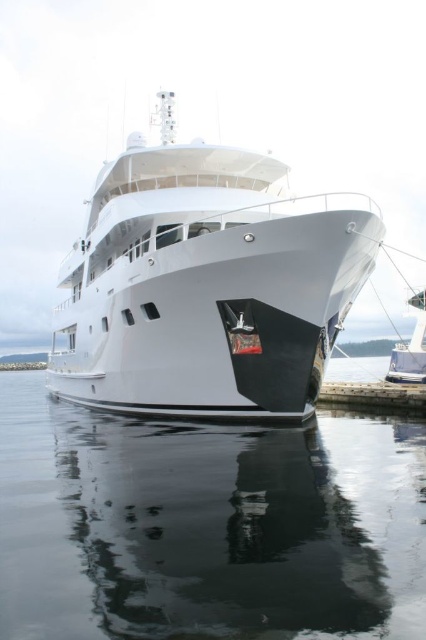
Who is positioned more to the right, white glossy yacht at center or white glossy yacht at right?

white glossy yacht at right

Is white glossy yacht at center bigger than white glossy yacht at right?

Yes, white glossy yacht at center is bigger than white glossy yacht at right.

Is point (275, 253) closer to viewer compared to point (414, 380)?

Yes, it is.

Locate an element on the screen. This screenshot has height=640, width=426. white glossy yacht at center is located at coordinates (207, 284).

Does transparent water at lower center appear on the right side of white glossy yacht at center?

No, transparent water at lower center is not to the right of white glossy yacht at center.

You are a GUI agent. You are given a task and a screenshot of the screen. Output one action in this format:
    pyautogui.click(x=<x>, y=<y>)
    Task: Click on the transparent water at lower center
    
    Given the screenshot: What is the action you would take?
    pyautogui.click(x=207, y=525)

Does point (313, 518) come farther from viewer compared to point (195, 308)?

No, it is in front of (195, 308).

This screenshot has width=426, height=640. I want to click on transparent water at lower center, so click(207, 525).

Is transparent water at lower center positioned in front of white glossy yacht at right?

Yes, transparent water at lower center is in front of white glossy yacht at right.

Identify the location of transparent water at lower center. The image size is (426, 640). (207, 525).

At what (x,y) coordinates should I click in order to perform the action: click on transparent water at lower center. Please return your answer as a coordinate pair (x, y). Looking at the image, I should click on (207, 525).